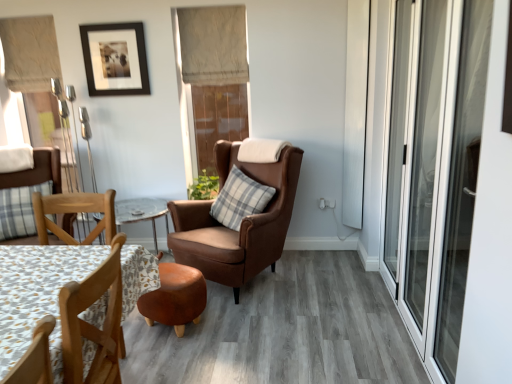
The height and width of the screenshot is (384, 512). What do you see at coordinates (30, 53) in the screenshot? I see `beige fabric curtain at upper left, placed as the second curtain when sorted from right to left` at bounding box center [30, 53].

Locate an element on the screen. Image resolution: width=512 pixels, height=384 pixels. plaid fabric pillow at center is located at coordinates (240, 199).

The height and width of the screenshot is (384, 512). What do you see at coordinates (240, 199) in the screenshot? I see `plaid fabric pillow at center` at bounding box center [240, 199].

You are a GUI agent. You are given a task and a screenshot of the screen. Output one action in this format:
    pyautogui.click(x=<x>, y=<y>)
    Task: Click on the transparent glass screen door at right
    
    Given the screenshot: What is the action you would take?
    pyautogui.click(x=433, y=167)

Find the location of a particular element. pillow below the green leafy plant at center (from the image's perspective) is located at coordinates (240, 199).

Is point (196, 186) less distant than point (232, 206)?

No, it is not.

Is green leafy plant at center completely or partially outside of plaid fabric pillow at center?

Yes.

Considering the sizes of objects green leafy plant at center and plaid fabric pillow at center in the image provided, who is thinner, green leafy plant at center or plaid fabric pillow at center?

Thinner between the two is green leafy plant at center.

Is black matte picture frame at upper center far away from brown leather wingback chair at center, the first chair positioned from the right?

Yes.

From the picture: Is black matte picture frame at upper center positioned with its back to brown leather wingback chair at center, the first chair positioned from the right?

No, black matte picture frame at upper center's orientation is not away from brown leather wingback chair at center, the first chair positioned from the right.

Would you say black matte picture frame at upper center is to the left or to the right of brown leather wingback chair at center, the first chair positioned from the right, in the picture?

black matte picture frame at upper center is positioned on brown leather wingback chair at center, the first chair positioned from the right,'s left side.

Who is bigger, black matte picture frame at upper center or brown leather wingback chair at center, the 2th chair positioned from the left?

brown leather wingback chair at center, the 2th chair positioned from the left, is bigger.

Is brown leather wingback chair at center, the first chair positioned from the right, directly adjacent to beige fabric curtain at upper center, which ranks as the 1th curtain in right-to-left order?

They are not placed beside each other.

Considering the sizes of brown leather wingback chair at center, the 2th chair positioned from the left, and beige fabric curtain at upper center, which ranks as the 1th curtain in right-to-left order, in the image, is brown leather wingback chair at center, the 2th chair positioned from the left, wider or thinner than beige fabric curtain at upper center, which ranks as the 1th curtain in right-to-left order,?

brown leather wingback chair at center, the 2th chair positioned from the left, is wider than beige fabric curtain at upper center, which ranks as the 1th curtain in right-to-left order.

In the scene shown: Is brown leather wingback chair at center, the 2th chair positioned from the left, positioned before beige fabric curtain at upper center, which ranks as the 1th curtain in right-to-left order?

Yes, brown leather wingback chair at center, the 2th chair positioned from the left, is in front of beige fabric curtain at upper center, which ranks as the 1th curtain in right-to-left order.

Looking at this image, is brown leather wingback chair at center, the 2th chair positioned from the left, smaller than beige fabric curtain at upper center, the second curtain positioned from the left?

No.

Which object is further away from the camera, black matte picture frame at upper center or plaid fabric pillow at center?

black matte picture frame at upper center.

Considering the sizes of black matte picture frame at upper center and plaid fabric pillow at center in the image, is black matte picture frame at upper center taller or shorter than plaid fabric pillow at center?

In the image, black matte picture frame at upper center appears to be taller than plaid fabric pillow at center.

Can you confirm if black matte picture frame at upper center is smaller than plaid fabric pillow at center?

Correct, black matte picture frame at upper center occupies less space than plaid fabric pillow at center.

From the image's perspective, is black matte picture frame at upper center located beneath plaid fabric pillow at center?

No, from the image's perspective, black matte picture frame at upper center is not below plaid fabric pillow at center.

Is transparent glass screen door at right at the right side of plaid fabric chair at lower left, acting as the 1th chair starting from the left?

Yes, transparent glass screen door at right is to the right of plaid fabric chair at lower left, acting as the 1th chair starting from the left.

Considering the sizes of transparent glass screen door at right and plaid fabric chair at lower left, placed as the 2th chair when sorted from right to left, in the image, is transparent glass screen door at right wider or thinner than plaid fabric chair at lower left, placed as the 2th chair when sorted from right to left,?

Considering their sizes, transparent glass screen door at right looks slimmer than plaid fabric chair at lower left, placed as the 2th chair when sorted from right to left.

In the scene shown: Which is behind, transparent glass screen door at right or plaid fabric chair at lower left, acting as the 1th chair starting from the left?

Positioned behind is plaid fabric chair at lower left, acting as the 1th chair starting from the left.

Is transparent glass screen door at right not close to plaid fabric chair at lower left, acting as the 1th chair starting from the left?

Yes.

From the image's perspective, which one is positioned lower, beige fabric curtain at upper center, which ranks as the 1th curtain in right-to-left order, or plaid fabric chair at lower left, acting as the 1th chair starting from the left?

plaid fabric chair at lower left, acting as the 1th chair starting from the left.

Does beige fabric curtain at upper center, the second curtain positioned from the left, touch plaid fabric chair at lower left, placed as the 2th chair when sorted from right to left?

beige fabric curtain at upper center, the second curtain positioned from the left, and plaid fabric chair at lower left, placed as the 2th chair when sorted from right to left, are not in contact.

Starting from the plaid fabric chair at lower left, placed as the 2th chair when sorted from right to left, which curtain is the 1st one behind? Please provide its 2D coordinates.

[(213, 45)]

Between beige fabric curtain at upper center, which ranks as the 1th curtain in right-to-left order, and plaid fabric chair at lower left, acting as the 1th chair starting from the left, which one appears on the left side from the viewer's perspective?

From the viewer's perspective, plaid fabric chair at lower left, acting as the 1th chair starting from the left, appears more on the left side.

Considering the relative positions of transparent glass screen door at right and brown leather wingback chair at center, the 2th chair positioned from the left, in the image provided, is transparent glass screen door at right to the left of brown leather wingback chair at center, the 2th chair positioned from the left, from the viewer's perspective?

In fact, transparent glass screen door at right is to the right of brown leather wingback chair at center, the 2th chair positioned from the left.

In terms of size, does transparent glass screen door at right appear bigger or smaller than brown leather wingback chair at center, the first chair positioned from the right?

transparent glass screen door at right is smaller than brown leather wingback chair at center, the first chair positioned from the right.

Which is in front, transparent glass screen door at right or brown leather wingback chair at center, the 2th chair positioned from the left?

transparent glass screen door at right.

Find the location of a particular element. The height and width of the screenshot is (384, 512). screen door on the right of brown leather wingback chair at center, the 2th chair positioned from the left is located at coordinates (433, 167).

Image resolution: width=512 pixels, height=384 pixels. In the image, there is a plaid fabric pillow at center. In order to click on plant above it (from the image's perspective) in this screenshot , I will do `click(203, 187)`.

Locate an element on the screen. chair on the right of the black matte picture frame at upper center is located at coordinates (241, 223).

Based on the photo, looking at the image, which one is located closer to patterned fabric coffee table at lower left, plaid fabric chair at lower left, placed as the 2th chair when sorted from right to left, or beige fabric curtain at upper left, acting as the 1th curtain starting from the left?

Based on the image, plaid fabric chair at lower left, placed as the 2th chair when sorted from right to left, appears to be nearer to patterned fabric coffee table at lower left.

Consider the image. Estimate the real-world distances between objects in this image. Which object is closer to green leafy plant at center, patterned fabric coffee table at lower left or transparent glass screen door at right?

Among the two, transparent glass screen door at right is located nearer to green leafy plant at center.

From the image, which object appears to be farther from beige fabric curtain at upper center, which ranks as the 1th curtain in right-to-left order, transparent glass screen door at right or brown leather wingback chair at center, the first chair positioned from the right?

transparent glass screen door at right.

Based on the photo, based on their spatial positions, is beige fabric curtain at upper center, the second curtain positioned from the left, or plaid fabric chair at lower left, placed as the 2th chair when sorted from right to left, further from beige fabric curtain at upper left, placed as the second curtain when sorted from right to left?

The object further to beige fabric curtain at upper left, placed as the second curtain when sorted from right to left, is beige fabric curtain at upper center, the second curtain positioned from the left.

Considering their positions, is beige fabric curtain at upper left, acting as the 1th curtain starting from the left, positioned further to transparent glass screen door at right than black matte picture frame at upper center?

The object further to transparent glass screen door at right is beige fabric curtain at upper left, acting as the 1th curtain starting from the left.

Estimate the real-world distances between objects in this image. Which object is closer to patterned fabric coffee table at lower left, beige fabric curtain at upper left, acting as the 1th curtain starting from the left, or transparent glass screen door at right?

The object closer to patterned fabric coffee table at lower left is transparent glass screen door at right.

When comparing their distances from plaid fabric chair at lower left, acting as the 1th chair starting from the left, does plaid fabric pillow at center or beige fabric curtain at upper center, which ranks as the 1th curtain in right-to-left order, seem further?

Based on the image, beige fabric curtain at upper center, which ranks as the 1th curtain in right-to-left order, appears to be further to plaid fabric chair at lower left, acting as the 1th chair starting from the left.

Looking at the image, which one is located closer to plaid fabric pillow at center, green leafy plant at center or black matte picture frame at upper center?

green leafy plant at center lies closer to plaid fabric pillow at center than the other object.

Identify the location of picture frame between beige fabric curtain at upper center, which ranks as the 1th curtain in right-to-left order, and green leafy plant at center, in the vertical direction. This screenshot has height=384, width=512. (115, 59).

Find the location of a particular element. Image resolution: width=512 pixels, height=384 pixels. picture frame between transparent glass screen door at right and green leafy plant at center in the front-back direction is located at coordinates (115, 59).

Find the location of a particular element. This screenshot has width=512, height=384. curtain situated between beige fabric curtain at upper left, acting as the 1th curtain starting from the left, and brown leather wingback chair at center, the 2th chair positioned from the left, from left to right is located at coordinates point(213,45).

Locate an element on the screen. This screenshot has width=512, height=384. curtain between beige fabric curtain at upper left, placed as the second curtain when sorted from right to left, and transparent glass screen door at right is located at coordinates (213, 45).